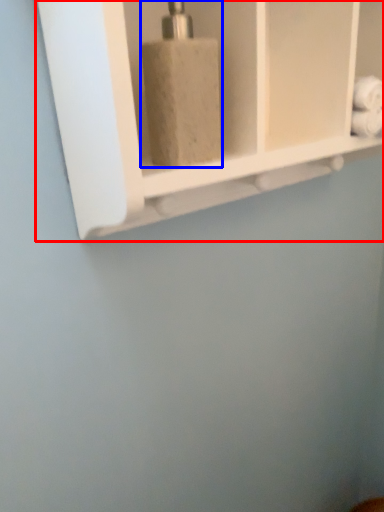
Question: Which object appears closest to the camera in this image, shelf (highlighted by a red box) or soap dispenser (highlighted by a blue box)?

Choices:
 (A) shelf
 (B) soap dispenser

Answer: (A)